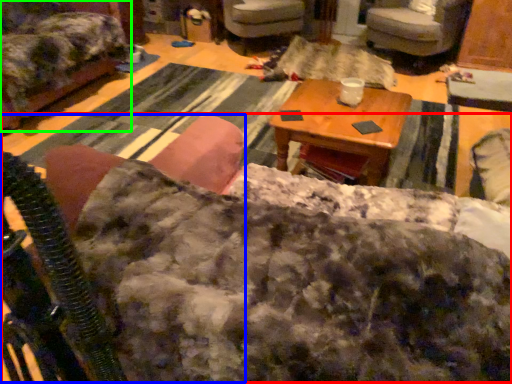
Question: Considering the real-world distances, which object is closest to couch (highlighted by a red box)? rocking chair (highlighted by a blue box) or chair (highlighted by a green box).

Choices:
 (A) rocking chair
 (B) chair

Answer: (A)